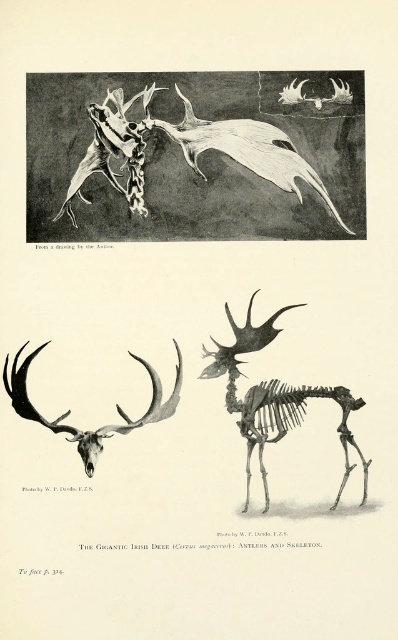
Who is lower down, bone-like skeleton at center or black bone antlers at center?

bone-like skeleton at center

Can you confirm if bone-like skeleton at center is wider than black bone antlers at center?

No, bone-like skeleton at center is not wider than black bone antlers at center.

Is point (249, 336) farther from camera compared to point (156, 396)?

No, it is in front of (156, 396).

This screenshot has height=640, width=398. I want to click on bone-like skeleton at center, so click(275, 397).

Does bone-like antlers at upper center have a smaller size compared to black bone antlers at center?

No, bone-like antlers at upper center is not smaller than black bone antlers at center.

What are the coordinates of `bone-like antlers at upper center` in the screenshot? It's located at (187, 150).

Is bone-like antlers at upper center behind bone-like skeleton at center?

Yes, bone-like antlers at upper center is further from the viewer.

The height and width of the screenshot is (640, 398). Identify the location of bone-like antlers at upper center. (187, 150).

This screenshot has width=398, height=640. In order to click on bone-like antlers at upper center in this screenshot , I will do `click(187, 150)`.